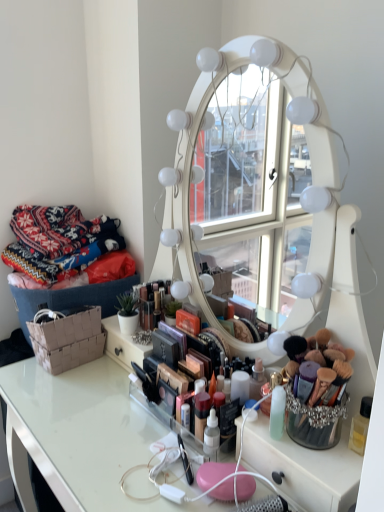
Question: Would you say brown woven basket at lower left is to the left or to the right of clear acrylic table at center in the picture?

Choices:
 (A) left
 (B) right

Answer: (A)

Question: In the image, is brown woven basket at lower left positioned in front of or behind clear acrylic table at center?

Choices:
 (A) front
 (B) behind

Answer: (B)

Question: Which is nearer to the clear acrylic table at center?

Choices:
 (A) knitted fabric at left
 (B) brown woven basket at lower left

Answer: (B)

Question: Based on their relative distances, which object is nearer to the brown woven basket at lower left?

Choices:
 (A) clear acrylic table at center
 (B) knitted fabric at left

Answer: (A)